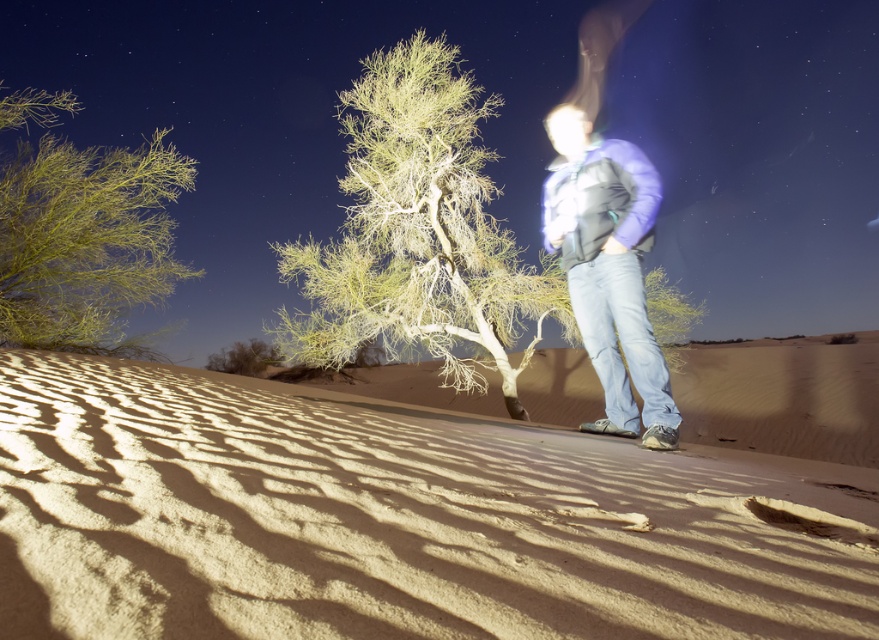
Question: Can you confirm if smooth sand at center is positioned below green leafy tree at center?

Choices:
 (A) no
 (B) yes

Answer: (B)

Question: Is smooth sand at center closer to camera compared to purple fleece jacket at center?

Choices:
 (A) no
 (B) yes

Answer: (B)

Question: Considering the real-world distances, which object is closest to the green leafy tree at center?

Choices:
 (A) smooth sand at center
 (B) purple fleece jacket at center

Answer: (B)

Question: Is smooth sand at center to the left of green leafy shrub at left from the viewer's perspective?

Choices:
 (A) no
 (B) yes

Answer: (A)

Question: Which object is the closest to the purple fleece jacket at center?

Choices:
 (A) smooth sand at center
 (B) green leafy shrub at left
 (C) green leafy tree at center

Answer: (A)

Question: Which of these objects is positioned closest to the purple fleece jacket at center?

Choices:
 (A) smooth sand at center
 (B) green leafy shrub at left
 (C) green leafy tree at center

Answer: (A)